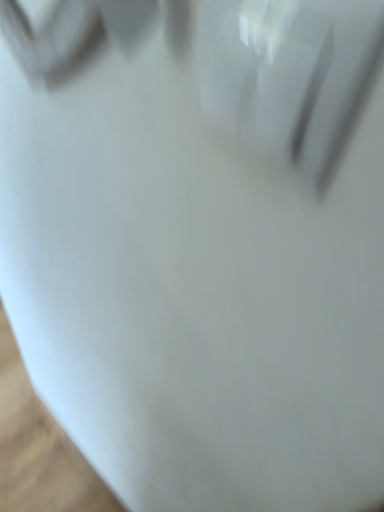
Describe the element at coordinates (39, 448) in the screenshot. I see `light brown wood at lower left` at that location.

Identify the location of light brown wood at lower left. This screenshot has height=512, width=384. (39, 448).

The image size is (384, 512). I want to click on light brown wood at lower left, so click(39, 448).